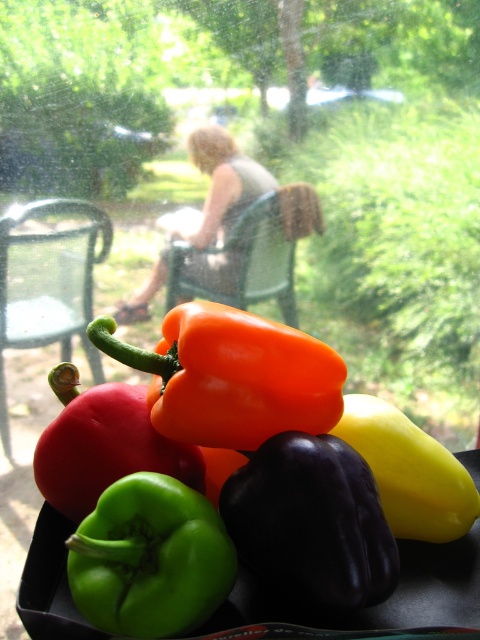
Can you confirm if orange glossy bell pepper at center is shorter than blonde hair at center?

Indeed, orange glossy bell pepper at center has a lesser height compared to blonde hair at center.

Can you confirm if orange glossy bell pepper at center is smaller than blonde hair at center?

No, orange glossy bell pepper at center is not smaller than blonde hair at center.

Where is `orange glossy bell pepper at center`? This screenshot has height=640, width=480. orange glossy bell pepper at center is located at coordinates (231, 376).

You are a GUI agent. You are given a task and a screenshot of the screen. Output one action in this format:
    pyautogui.click(x=<x>, y=<y>)
    Task: Click on the orange glossy bell pepper at center
    This screenshot has width=480, height=640.
    Given the screenshot: What is the action you would take?
    pyautogui.click(x=231, y=376)

Is point (220, 305) positioned before point (127, 557)?

No, it is behind (127, 557).

Which is below, orange glossy bell pepper at center or green matte bell pepper at lower left?

green matte bell pepper at lower left is below.

Identify the location of orange glossy bell pepper at center. (231, 376).

You are a GUI agent. You are given a task and a screenshot of the screen. Output one action in this format:
    pyautogui.click(x=<x>, y=<y>)
    Task: Click on the orange glossy bell pepper at center
    The height and width of the screenshot is (640, 480).
    Given the screenshot: What is the action you would take?
    pyautogui.click(x=231, y=376)

Is point (168, 595) farther from camera compared to point (243, 160)?

No.

Is green matte bell pepper at lower left to the left of blonde hair at center from the viewer's perspective?

In fact, green matte bell pepper at lower left is to the right of blonde hair at center.

This screenshot has width=480, height=640. Find the location of `green matte bell pepper at lower left`. green matte bell pepper at lower left is located at coordinates (149, 557).

Image resolution: width=480 pixels, height=640 pixels. In order to click on green matte bell pepper at lower left in this screenshot , I will do `click(149, 557)`.